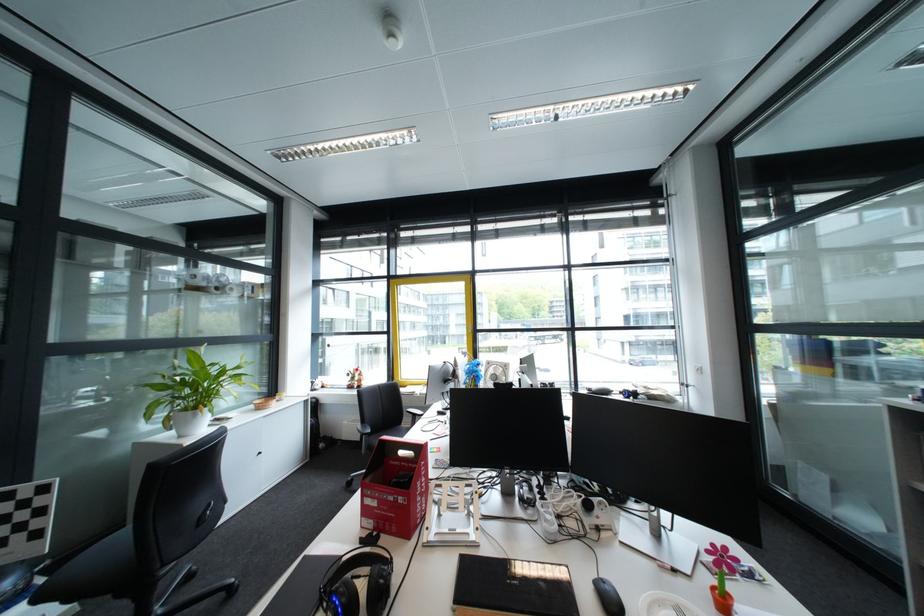
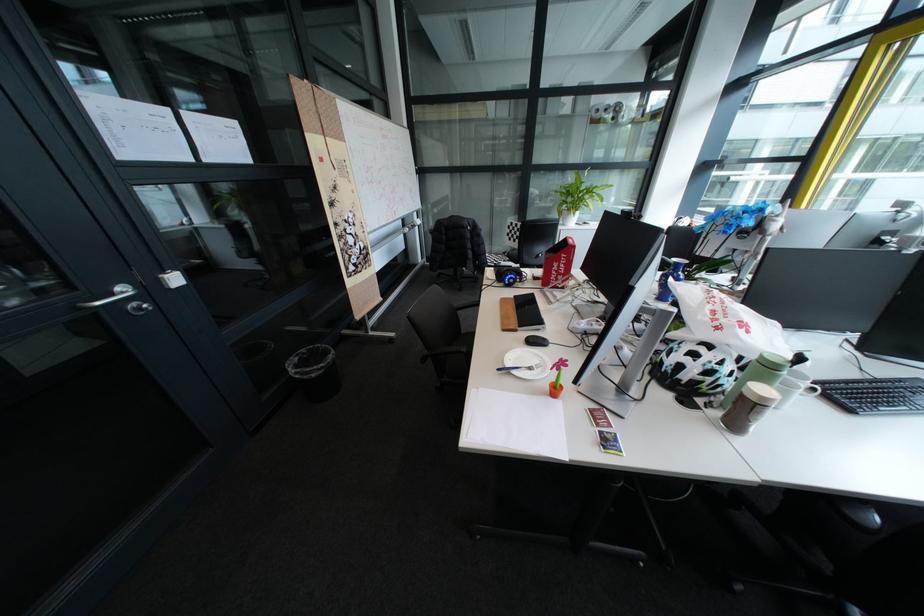
Locate, in the second image, the point that corresponds to [160,415] in the first image.

(572, 209)